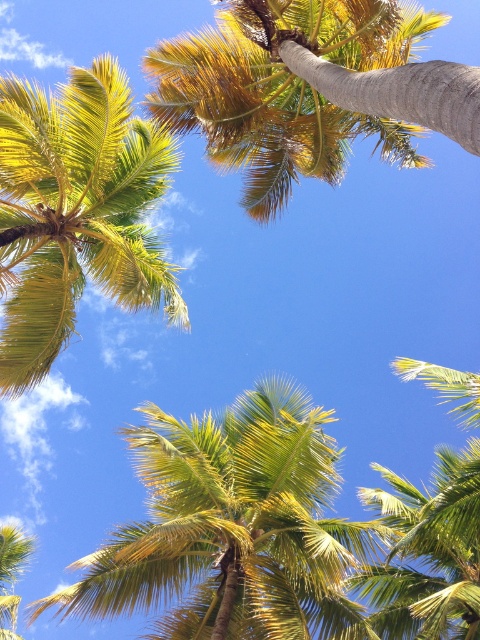
You are standing under the palm trees looking up. Which object is closer to you between the green leafy palm at center and the golden yellow leaves at upper left?

The green leafy palm at center is closer to you because it is in front of the golden yellow leaves at upper left.

You are a bird looking for a place to perch. You see the golden yellow leaves at upper left and the green leafy palm at lower left. Which one has a larger area for you to land comfortably?

The golden yellow leaves at upper left is bigger than the green leafy palm at lower left, so it has a larger area for you to land comfortably.

Based on the photo, you are standing under the palm trees looking up. Which object is closer to the ground, the golden yellow leaves at upper left or the green leafy coconut tree at upper center?

The golden yellow leaves at upper left is located below the green leafy coconut tree at upper center, so the golden yellow leaves at upper left is closer to the ground.